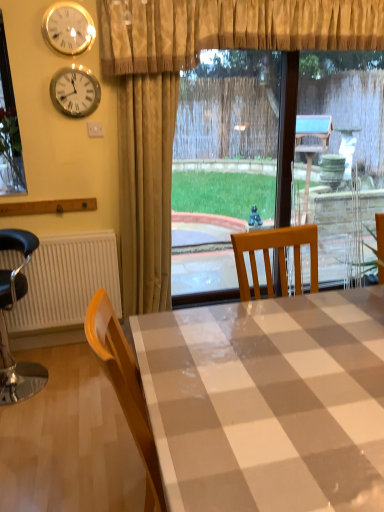
Question: From a real-world perspective, is metallic black chair at left physically located above or below metallic clock at upper left, which is the second clock in top-to-bottom order?

Choices:
 (A) above
 (B) below

Answer: (B)

Question: Based on their sizes in the image, would you say metallic black chair at left is bigger or smaller than metallic clock at upper left, which is the second clock in top-to-bottom order?

Choices:
 (A) small
 (B) big

Answer: (B)

Question: Estimate the real-world distances between objects in this image. Which object is farther from the gold textured curtain at upper center, arranged as the first curtain when ordered from the bottom?

Choices:
 (A) white ribbed radiator at lower left
 (B) white glossy table at center
 (C) gold metallic clock at upper left, the second clock ordered from the bottom
 (D) metallic clock at upper left, which is the second clock in top-to-bottom order
 (E) metallic black chair at left

Answer: (B)

Question: Which is farther from the metallic clock at upper left, the first clock in the bottom-to-top sequence?

Choices:
 (A) white ribbed radiator at lower left
 (B) white glossy table at center
 (C) gold metallic clock at upper left, positioned as the first clock in top-to-bottom order
 (D) metallic black chair at left
 (E) beige textured curtain at upper center, placed as the 2th curtain when sorted from bottom to top

Answer: (B)